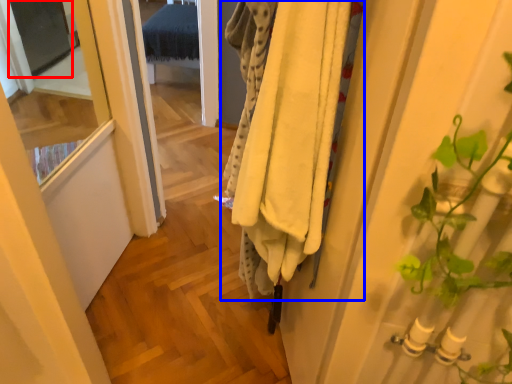
Question: Which object is closer to the camera taking this photo, screen door (highlighted by a red box) or clothing (highlighted by a blue box)?

Choices:
 (A) screen door
 (B) clothing

Answer: (B)